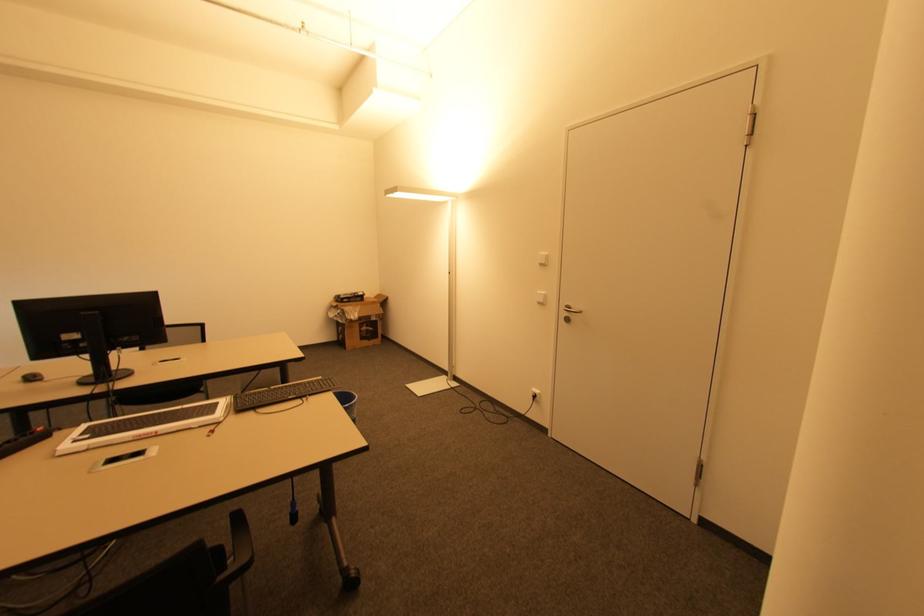
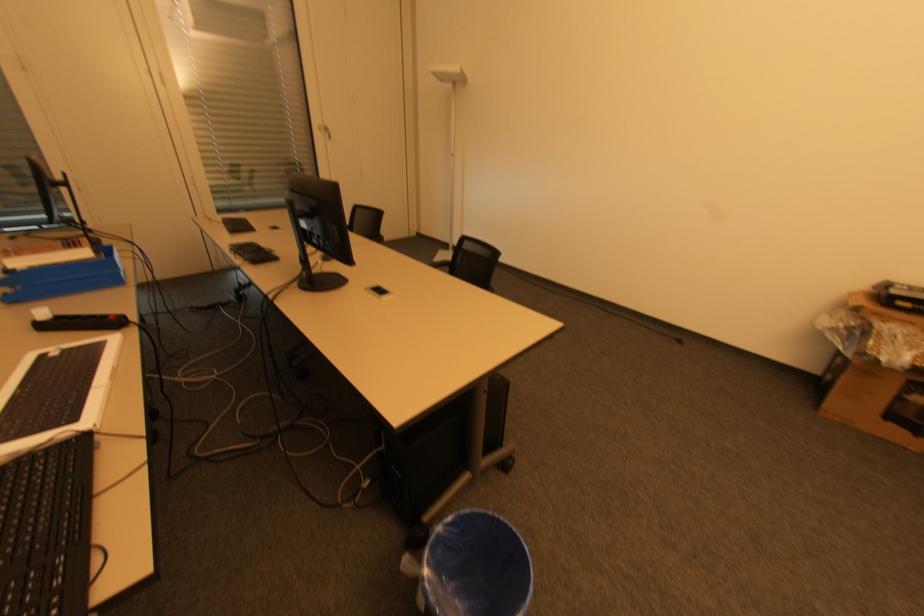
In the second image, find the point that corresponds to [341,314] in the first image.

(850, 328)